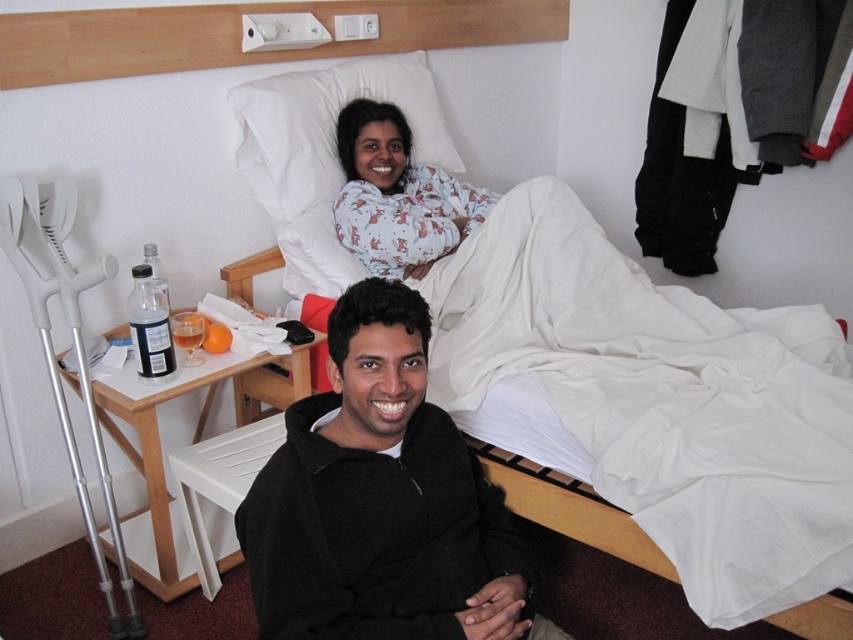
Question: Which point appears farthest from the camera in this image?

Choices:
 (A) (311, 596)
 (B) (769, 461)
 (C) (384, 92)

Answer: (C)

Question: Can you confirm if white fabric hospital bed at center is wider than black fleece at lower center?

Choices:
 (A) yes
 (B) no

Answer: (A)

Question: From the image, what is the correct spatial relationship of black fleece at lower center in relation to white soft pillow at upper center?

Choices:
 (A) left
 (B) right

Answer: (B)

Question: Is white fabric hospital bed at center thinner than white soft pillow at upper center?

Choices:
 (A) no
 (B) yes

Answer: (A)

Question: Which of the following is the closest to the observer?

Choices:
 (A) black fleece at lower center
 (B) white fabric hospital bed at center
 (C) white soft pillow at upper center
 (D) printed cotton pajamas at upper center

Answer: (A)

Question: Which point is closer to the camera taking this photo?

Choices:
 (A) (344, 180)
 (B) (297, 417)
 (C) (589, 228)

Answer: (B)